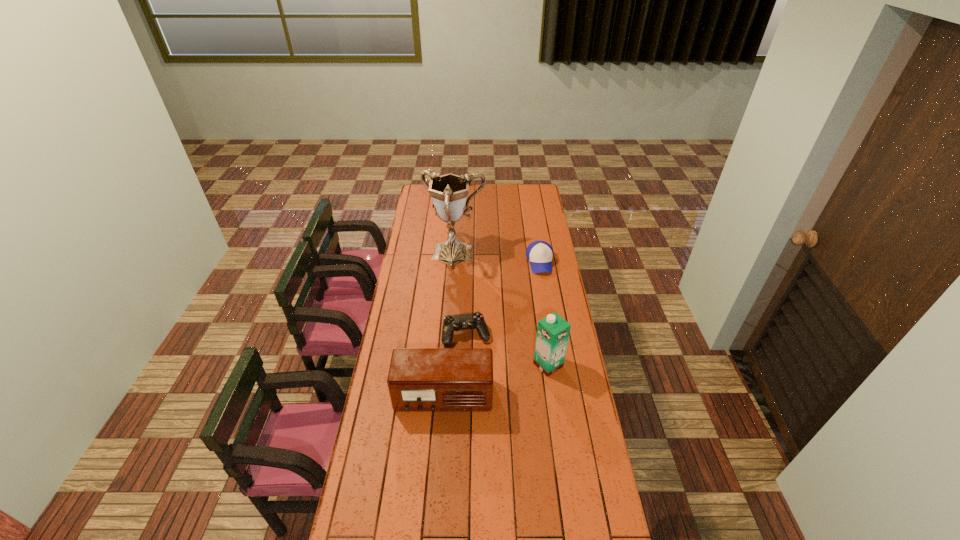
Identify the location of trophy cup. The image size is (960, 540). (448, 192).

Find the location of a particular element. Image resolution: width=960 pixels, height=540 pixels. the second tallest object is located at coordinates (553, 331).

Find the location of `carton`. carton is located at coordinates (553, 331).

The height and width of the screenshot is (540, 960). I want to click on the third tallest object, so pos(420,379).

Locate an element on the screen. the nearest object is located at coordinates (420, 379).

This screenshot has width=960, height=540. Find the location of `baseball cap`. baseball cap is located at coordinates (539, 253).

Where is `the third farthest object`? the third farthest object is located at coordinates (451, 323).

This screenshot has width=960, height=540. I want to click on vacant space located 0.120m on the back of the tallest object, so click(x=457, y=226).

This screenshot has width=960, height=540. Find the location of `blank space located 0.320m on the back of the fourth farthest object`. blank space located 0.320m on the back of the fourth farthest object is located at coordinates coord(539,302).

Image resolution: width=960 pixels, height=540 pixels. In order to click on free space located on the front-facing side of the third tallest object in this screenshot , I will do `click(437, 489)`.